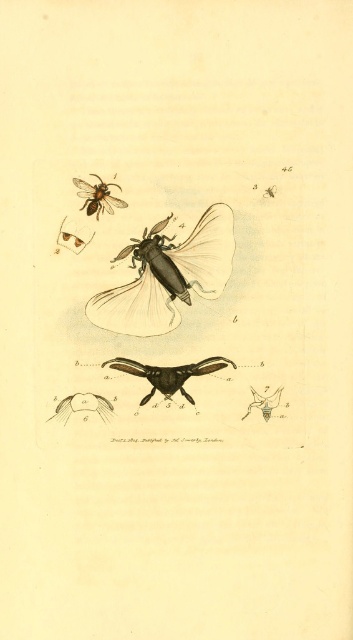
Question: Which of these objects is positioned farthest from the matte black insect at center?

Choices:
 (A) smooth brown feather at lower left
 (B) matte brown bee at upper left

Answer: (A)

Question: Among these points, which one is farthest from the camera?

Choices:
 (A) (182, 374)
 (B) (117, 205)
 (C) (216, 209)

Answer: (A)

Question: Considering the relative positions of matte black insect at center and matte brown bee at upper left in the image provided, where is matte black insect at center located with respect to matte brown bee at upper left?

Choices:
 (A) below
 (B) above

Answer: (A)

Question: Which point is closer to the camera taking this photo?

Choices:
 (A) (69, 397)
 (B) (164, 292)
 (C) (177, 371)
 (D) (110, 193)

Answer: (D)

Question: Is matte black insect at center positioned in front of matte brown bee at upper left?

Choices:
 (A) no
 (B) yes

Answer: (A)

Question: Is black glossy moth at center to the right of matte brown bee at upper left from the viewer's perspective?

Choices:
 (A) yes
 (B) no

Answer: (A)